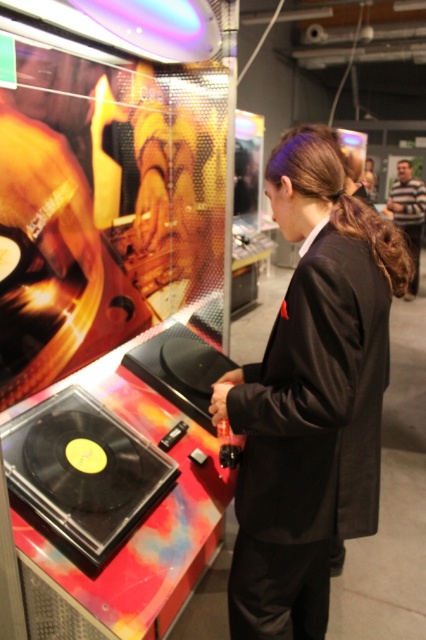
Between point (284, 196) and point (414, 253), which one is positioned behind?

Positioned behind is point (414, 253).

Is point (273, 326) positioned after point (405, 234)?

No, it is in front of (405, 234).

Who is more forward, (279, 225) or (414, 253)?

Point (279, 225) is in front.

The image size is (426, 640). Find the location of `black matte suit at center`. black matte suit at center is located at coordinates (310, 396).